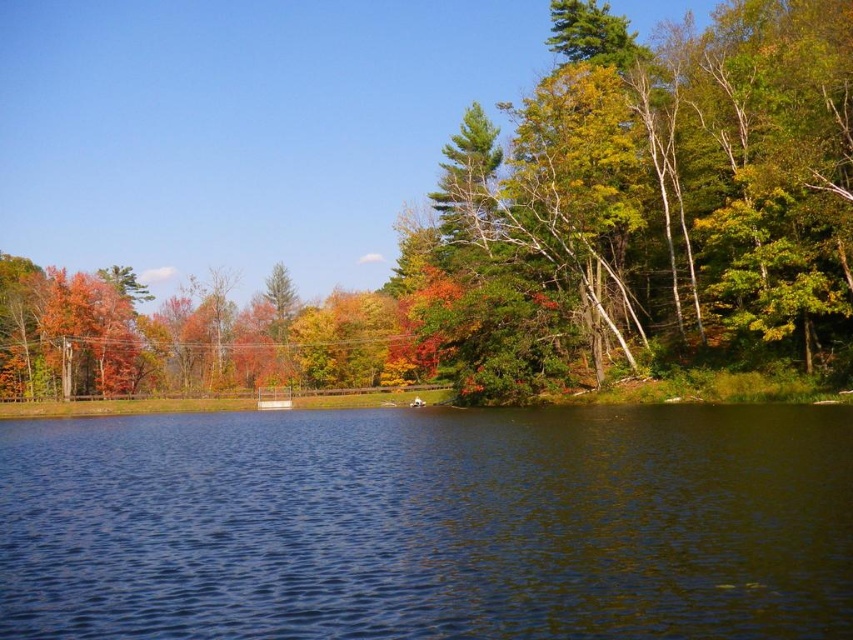
You are planning to take a photo of the autumn leaves at center and dark blue water at center from the lakeside. Which object will occupy more space in your photo?

The autumn leaves at center will occupy more space in your photo because its width is larger than that of the dark blue water at center.

You are standing at the lakeside and see two points marked in the image. The first point is at coordinates point (393, 182) and the second is at point (845, 477). Which point is closer to you from your current position?

Point (845, 477) is closer to you because it is in front of point (393, 182) according to their spatial arrangement.

You are standing on the lakeside path and see autumn leaves at center and dark blue water at center. Which object is closer to you?

The autumn leaves at center are closer to you because they are positioned over the dark blue water at center, indicating they are in a higher plane.